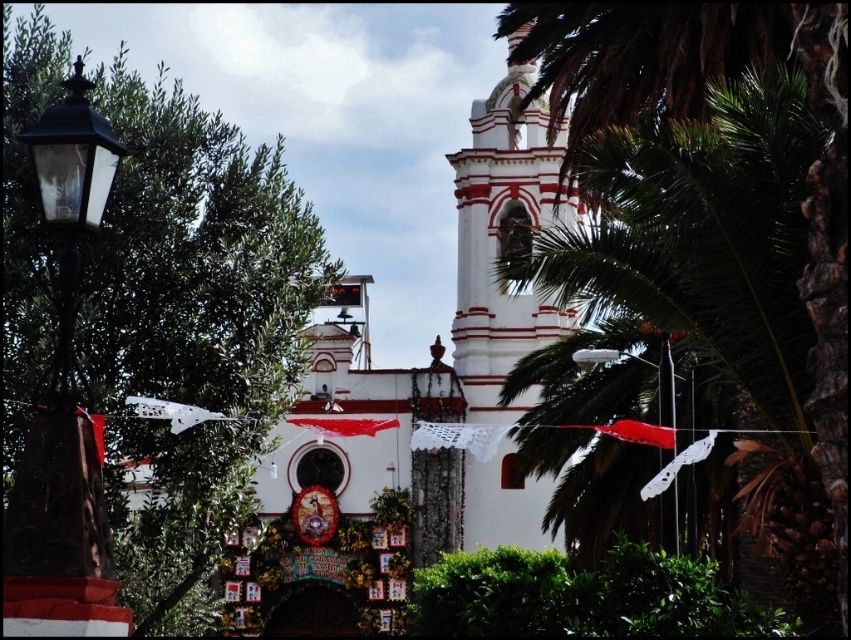
Question: In this image, where is green leafy tree at left located relative to white glossy streetlamp at center?

Choices:
 (A) above
 (B) below

Answer: (A)

Question: Does green leafy tree at left appear on the right side of white glossy streetlamp at center?

Choices:
 (A) no
 (B) yes

Answer: (A)

Question: Among these objects, which one is nearest to the camera?

Choices:
 (A) green leafy tree at left
 (B) white glossy streetlamp at center
 (C) green leafy palm tree at center

Answer: (A)

Question: Can you confirm if green leafy palm tree at center is bigger than white glossy streetlamp at center?

Choices:
 (A) no
 (B) yes

Answer: (B)

Question: Among these points, which one is farthest from the camera?

Choices:
 (A) (661, 132)
 (B) (671, 417)

Answer: (A)

Question: Which of the following is the closest to the observer?

Choices:
 (A) (672, 184)
 (B) (661, 358)

Answer: (A)